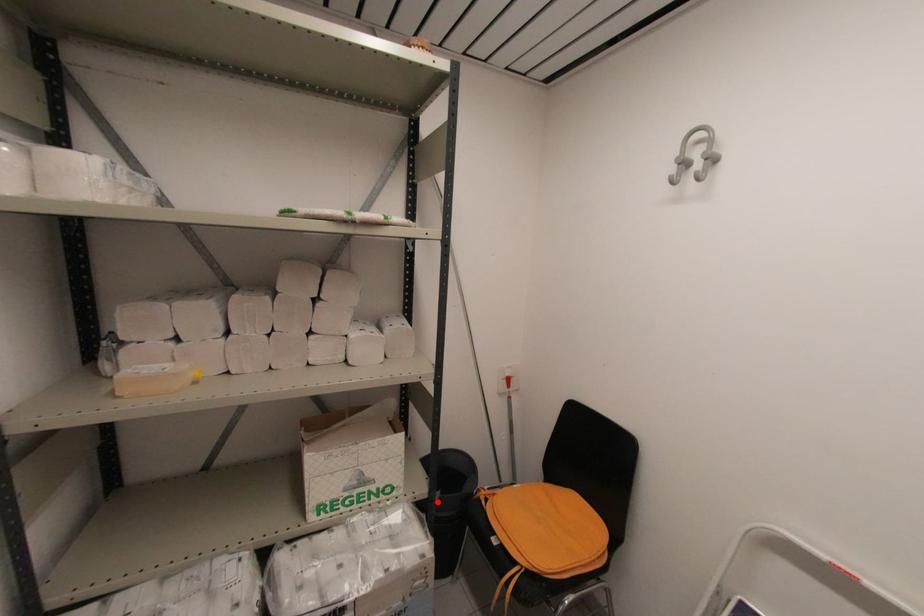
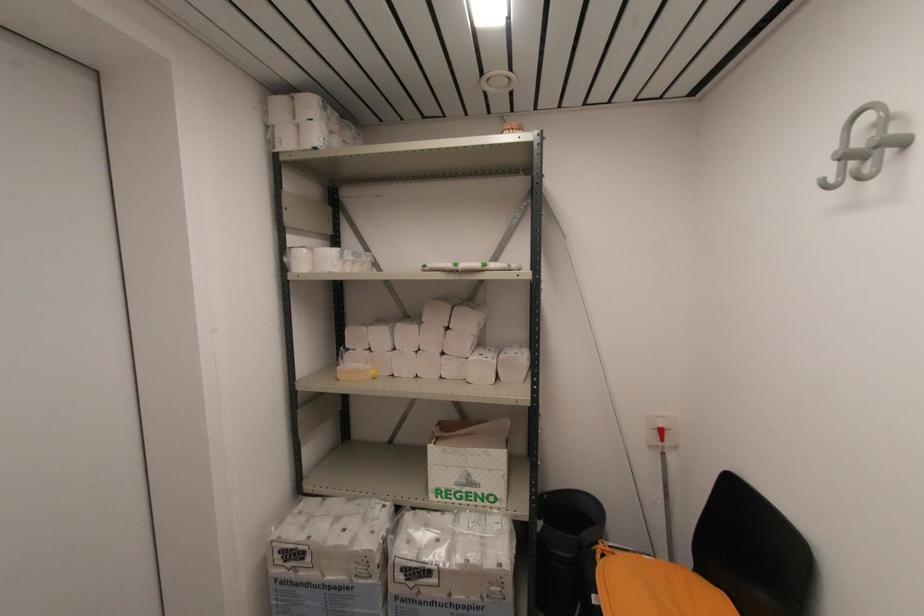
Locate, in the second image, the point that corresponds to the highlighted location in the first image.

(540, 530)